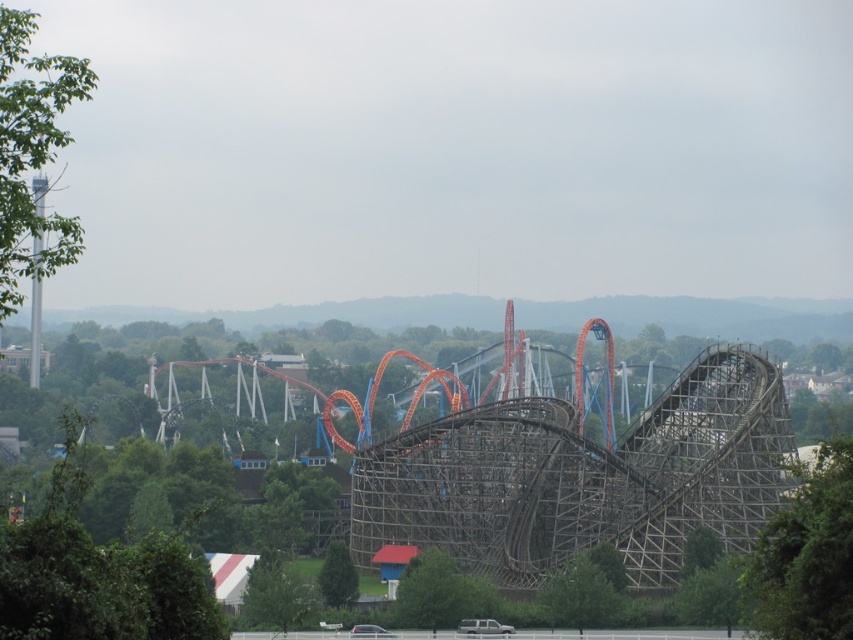
You are a visitor standing at the entrance of the amusement park. You see the green matte tree at center and the green leafy tree at lower center. Which tree is shorter?

The green matte tree at center is shorter than the green leafy tree at lower center.

You are standing at the entrance of the amusement park and see the green matte tree at center and the green leafy tree at lower center. Which tree is positioned more to the left side of the scene?

The green matte tree at center is positioned more to the left side of the scene than the green leafy tree at lower center.